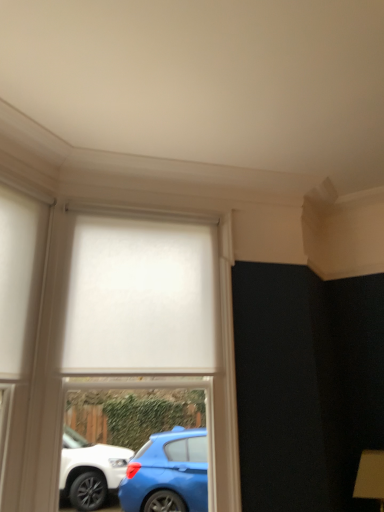
Question: Considering the relative sizes of white matte curtain at center and white matte roller blind at center in the image provided, is white matte curtain at center bigger than white matte roller blind at center?

Choices:
 (A) no
 (B) yes

Answer: (A)

Question: Considering the relative sizes of white matte curtain at center and white matte roller blind at center in the image provided, is white matte curtain at center thinner than white matte roller blind at center?

Choices:
 (A) yes
 (B) no

Answer: (A)

Question: Is white matte curtain at center directly adjacent to white matte roller blind at center?

Choices:
 (A) no
 (B) yes

Answer: (B)

Question: Is white matte curtain at center to the right of white matte roller blind at center from the viewer's perspective?

Choices:
 (A) yes
 (B) no

Answer: (B)

Question: Is white matte roller blind at center located within white matte curtain at center?

Choices:
 (A) yes
 (B) no

Answer: (B)

Question: Would you say white matte roller blind at center is to the left or to the right of white matte glass door at left in the picture?

Choices:
 (A) right
 (B) left

Answer: (A)

Question: In terms of width, does white matte roller blind at center look wider or thinner when compared to white matte glass door at left?

Choices:
 (A) thin
 (B) wide

Answer: (B)

Question: Is point (130, 382) positioned closer to the camera than point (34, 278)?

Choices:
 (A) farther
 (B) closer

Answer: (A)

Question: Relative to white matte glass door at left, is white matte roller blind at center in front or behind?

Choices:
 (A) behind
 (B) front

Answer: (A)

Question: Is white matte glass door at left inside the boundaries of white matte roller blind at center, or outside?

Choices:
 (A) inside
 (B) outside

Answer: (B)

Question: Would you say white matte glass door at left is to the left or to the right of white matte roller blind at center in the picture?

Choices:
 (A) left
 (B) right

Answer: (A)

Question: In the image, is white matte glass door at left positioned in front of or behind white matte roller blind at center?

Choices:
 (A) behind
 (B) front

Answer: (B)

Question: Does point (1, 206) appear closer or farther from the camera than point (213, 433)?

Choices:
 (A) closer
 (B) farther

Answer: (A)

Question: In the image, is white matte roller blind at center positioned in front of or behind white matte curtain at center?

Choices:
 (A) behind
 (B) front

Answer: (B)

Question: From a real-world perspective, is white matte roller blind at center positioned above or below white matte curtain at center?

Choices:
 (A) below
 (B) above

Answer: (A)